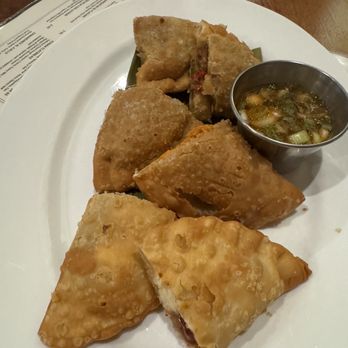
Where is `brown wood table top`? The image size is (348, 348). brown wood table top is located at coordinates (322, 28).